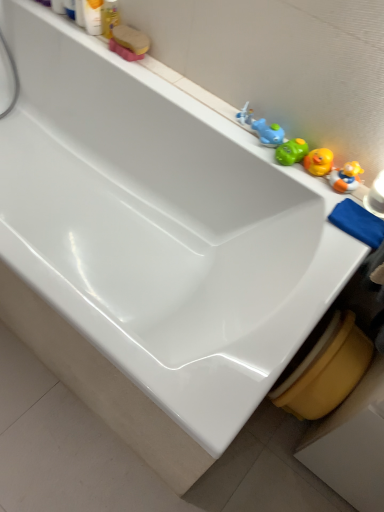
The image size is (384, 512). I want to click on free space above yellow matte plastic toilet bowl at lower right (from a real-world perspective), so click(x=342, y=333).